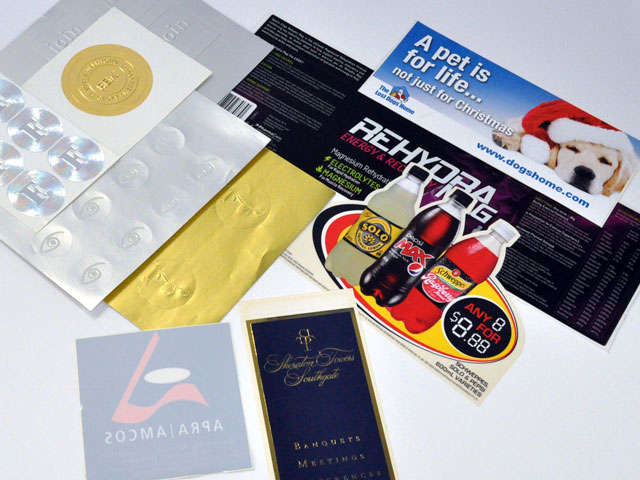
This screenshot has width=640, height=480. Identify the location of bottle of soda that resembles pepsi. (436, 233), (438, 224).